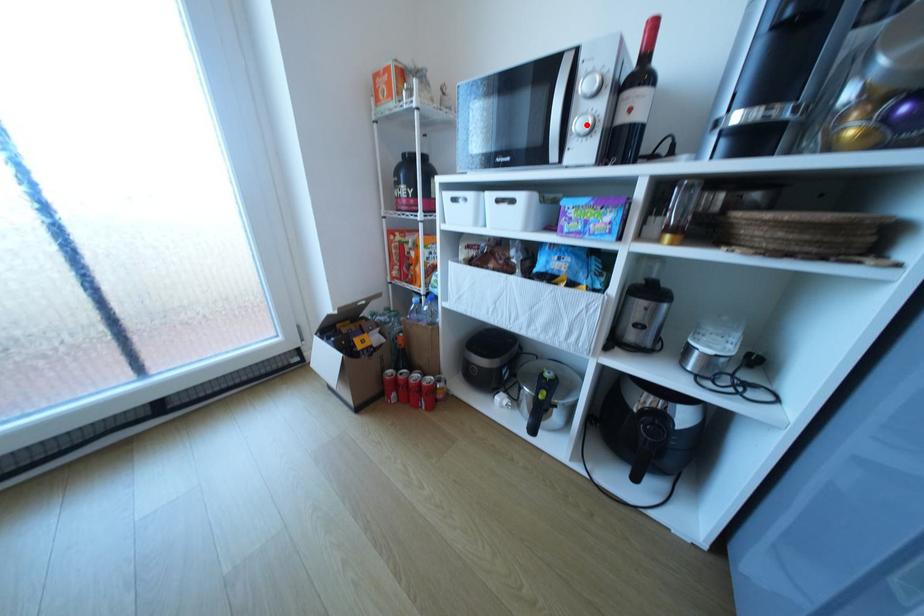
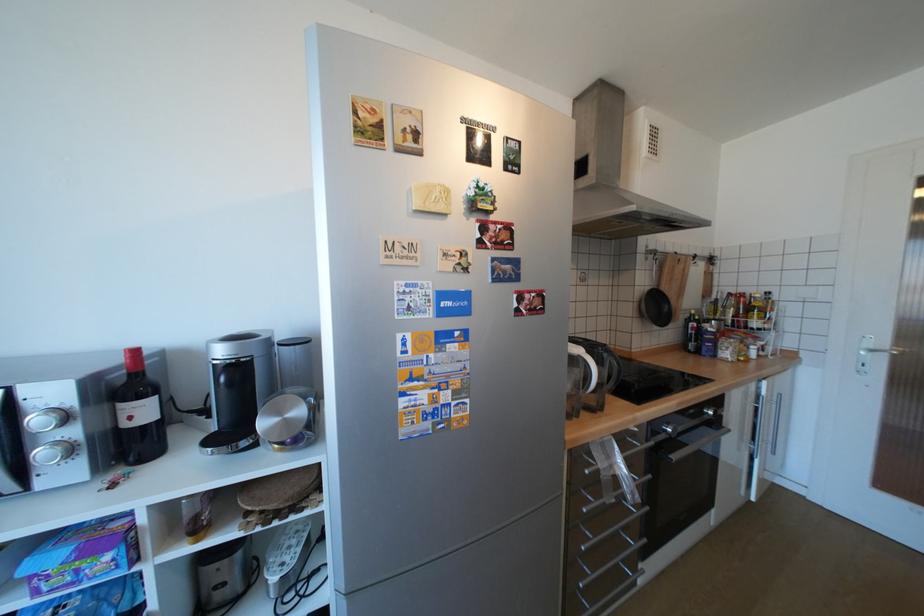
Locate, in the second image, the point that corresponds to the highlighted location in the first image.

(52, 453)